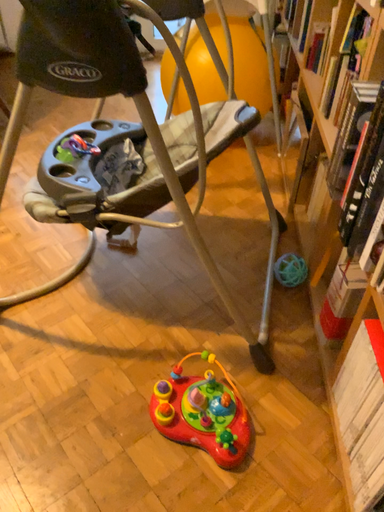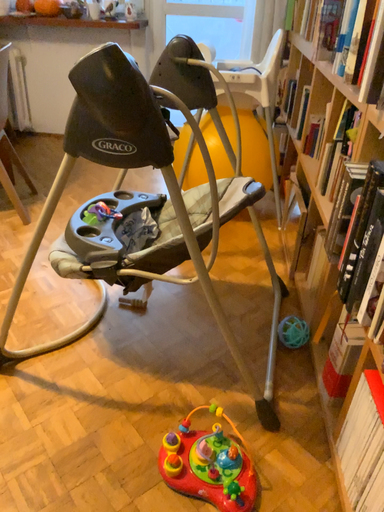
Question: Which way did the camera rotate in the video?

Choices:
 (A) rotated upward
 (B) rotated downward

Answer: (A)